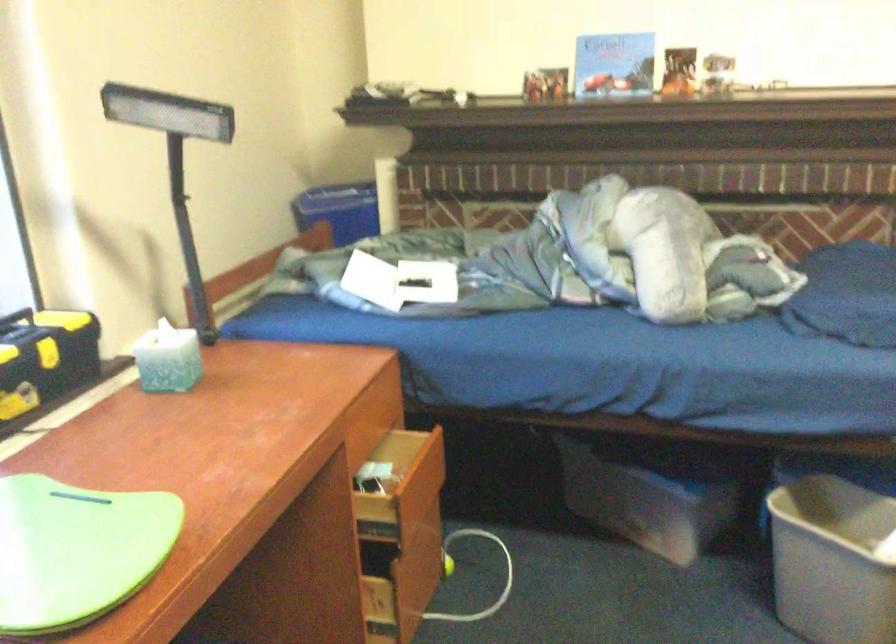
Where would you lift the yellow and black toolbox? Please return your answer as a coordinate pair (x, y).

(46, 354)